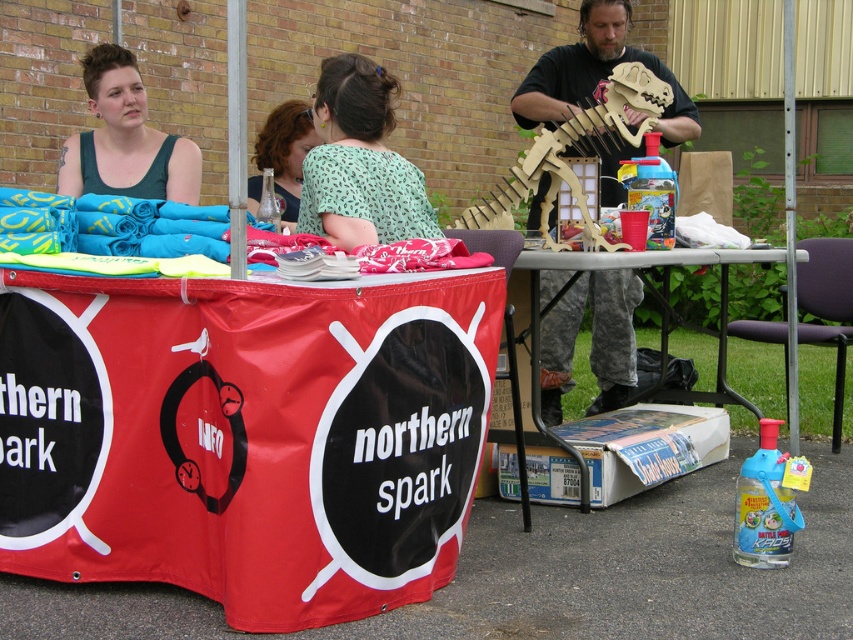
Can you confirm if green printed shirt at center is positioned to the left of matte glass bottle at center?

In fact, green printed shirt at center is to the right of matte glass bottle at center.

Looking at this image, which of these two, green printed shirt at center or matte glass bottle at center, stands taller?

With more height is green printed shirt at center.

Does point (387, 104) lie behind point (279, 170)?

No.

The image size is (853, 640). I want to click on green printed shirt at center, so click(358, 163).

Between green printed shirt at center and matte black tank top at upper left, which one appears on the left side from the viewer's perspective?

From the viewer's perspective, matte black tank top at upper left appears more on the left side.

Which is more to the right, green printed shirt at center or matte black tank top at upper left?

Positioned to the right is green printed shirt at center.

Image resolution: width=853 pixels, height=640 pixels. Describe the element at coordinates (358, 163) in the screenshot. I see `green printed shirt at center` at that location.

You are a GUI agent. You are given a task and a screenshot of the screen. Output one action in this format:
    pyautogui.click(x=<x>, y=<y>)
    Task: Click on the green printed shirt at center
    This screenshot has width=853, height=640.
    Given the screenshot: What is the action you would take?
    pyautogui.click(x=358, y=163)

Which of these two, wooden dinosaur skeleton at right or matte black tank top at upper left, stands shorter?

Standing shorter between the two is matte black tank top at upper left.

Which is in front, point (587, 147) or point (88, 182)?

Point (88, 182) is more forward.

Image resolution: width=853 pixels, height=640 pixels. I want to click on wooden dinosaur skeleton at right, so click(x=595, y=74).